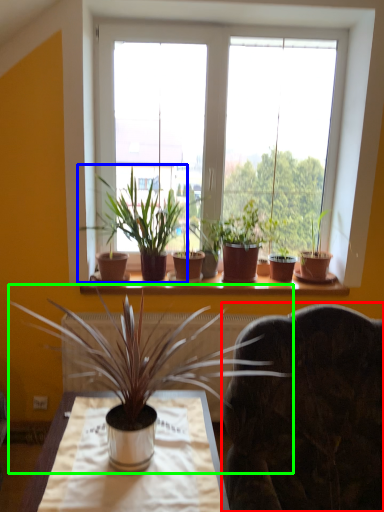
Question: Which is nearer to the swivel chair (highlighted by a red box)? houseplant (highlighted by a blue box) or houseplant (highlighted by a green box).

Choices:
 (A) houseplant
 (B) houseplant

Answer: (B)